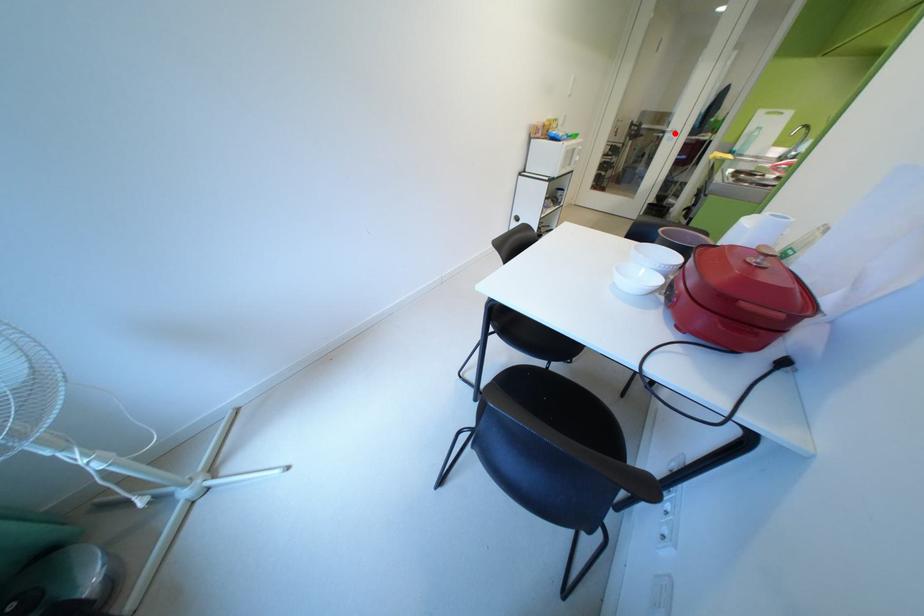
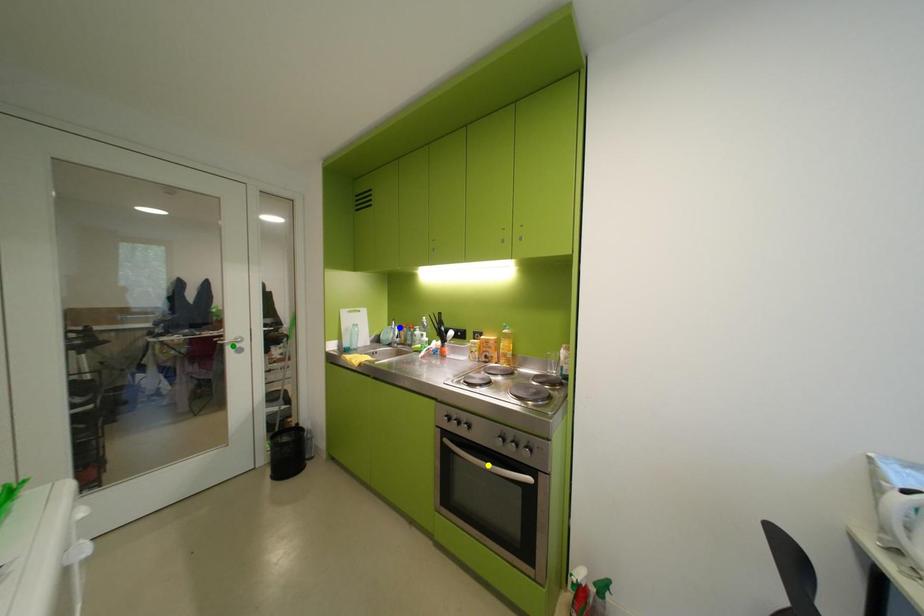
Question: I am providing you with two images of the same scene from different viewpoints. A red point is marked on the first image. You are given multiple points on the second image. Which point in image 2 is actually the same real-world point as the red point in image 1?

Choices:
 (A) blue point
 (B) green point
 (C) yellow point

Answer: (B)